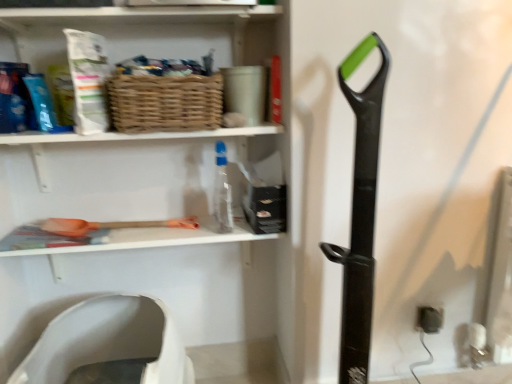
Question: From the image's perspective, is woven brown basket at upper center located beneath white plastic toilet seat at lower left?

Choices:
 (A) no
 (B) yes

Answer: (A)

Question: From the image's perspective, would you say woven brown basket at upper center is positioned over white plastic toilet seat at lower left?

Choices:
 (A) no
 (B) yes

Answer: (B)

Question: Considering the relative positions of woven brown basket at upper center and white plastic toilet seat at lower left in the image provided, is woven brown basket at upper center to the right of white plastic toilet seat at lower left from the viewer's perspective?

Choices:
 (A) no
 (B) yes

Answer: (B)

Question: Considering the relative sizes of woven brown basket at upper center and white plastic toilet seat at lower left in the image provided, is woven brown basket at upper center taller than white plastic toilet seat at lower left?

Choices:
 (A) no
 (B) yes

Answer: (A)

Question: Could you tell me if woven brown basket at upper center is turned towards white plastic toilet seat at lower left?

Choices:
 (A) no
 (B) yes

Answer: (A)

Question: Does woven brown basket at upper center have a lesser width compared to white plastic toilet seat at lower left?

Choices:
 (A) no
 (B) yes

Answer: (B)

Question: Is black plastic electric outlet at lower right bigger than woven brown basket at upper center?

Choices:
 (A) yes
 (B) no

Answer: (B)

Question: From the image's perspective, does black plastic electric outlet at lower right appear lower than woven brown basket at upper center?

Choices:
 (A) no
 (B) yes

Answer: (B)

Question: Is black plastic electric outlet at lower right next to woven brown basket at upper center?

Choices:
 (A) no
 (B) yes

Answer: (A)

Question: From a real-world perspective, is black plastic electric outlet at lower right on top of woven brown basket at upper center?

Choices:
 (A) yes
 (B) no

Answer: (B)

Question: Would you consider black plastic electric outlet at lower right to be distant from woven brown basket at upper center?

Choices:
 (A) yes
 (B) no

Answer: (B)

Question: Is black plastic electric outlet at lower right oriented away from woven brown basket at upper center?

Choices:
 (A) no
 (B) yes

Answer: (A)

Question: Considering the relative positions of woven brown basket at upper center and white matte shelf at upper center, which appears as the 1th shelf when ordered from the bottom, in the image provided, is woven brown basket at upper center to the right of white matte shelf at upper center, which appears as the 1th shelf when ordered from the bottom, from the viewer's perspective?

Choices:
 (A) no
 (B) yes

Answer: (B)